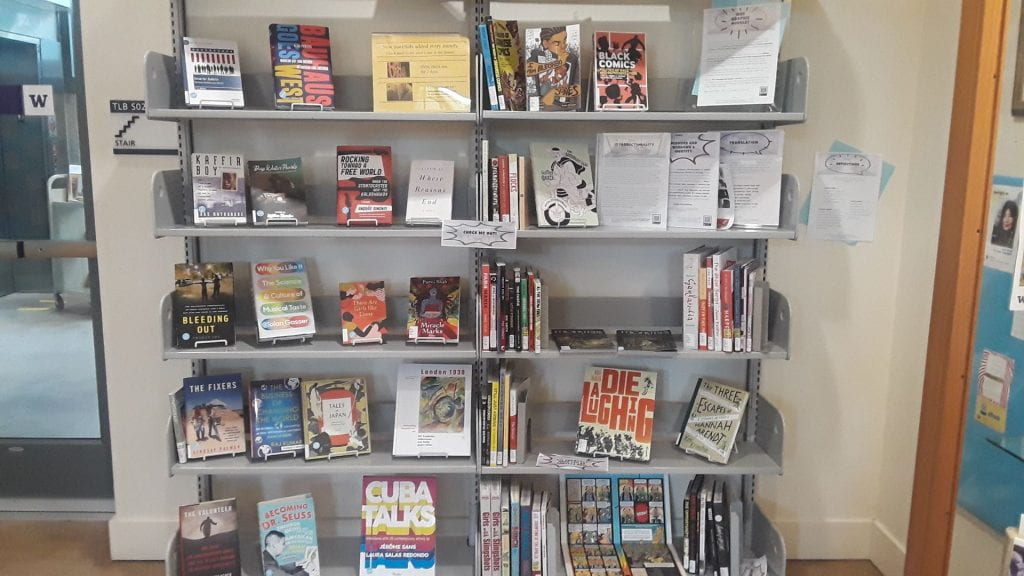
Image resolution: width=1024 pixels, height=576 pixels. What are the coordinates of `black "w" on white paper on glass door` in the screenshot? It's located at (38, 100).